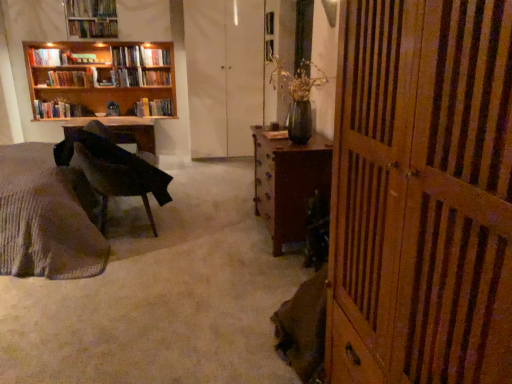
Question: Is hardcover book at upper left, which is counted as the fifth book, starting from the top, oriented towards white matte screen door at center, which ranks as the second screen door in right-to-left order?

Choices:
 (A) yes
 (B) no

Answer: (B)

Question: Does hardcover book at upper left, acting as the 3th book starting from the bottom, touch white matte screen door at center, which ranks as the second screen door in right-to-left order?

Choices:
 (A) no
 (B) yes

Answer: (A)

Question: Is hardcover book at upper left, acting as the 3th book starting from the bottom, closer to the viewer compared to white matte screen door at center, the 1th screen door from the left?

Choices:
 (A) yes
 (B) no

Answer: (B)

Question: Is hardcover book at upper left, which is counted as the fifth book, starting from the top, positioned behind white matte screen door at center, positioned as the 2th screen door in front-to-back order?

Choices:
 (A) yes
 (B) no

Answer: (A)

Question: From a real-world perspective, is hardcover book at upper left, acting as the 3th book starting from the bottom, over white matte screen door at center, positioned as the 2th screen door in front-to-back order?

Choices:
 (A) yes
 (B) no

Answer: (A)

Question: Considering the positions of velvet dark brown chair at left and hardcover book at upper center, the 5th book ordered from the bottom, in the image, is velvet dark brown chair at left taller or shorter than hardcover book at upper center, the 5th book ordered from the bottom,?

Choices:
 (A) short
 (B) tall

Answer: (B)

Question: From the image's perspective, relative to hardcover book at upper center, the 5th book ordered from the bottom, is velvet dark brown chair at left above or below?

Choices:
 (A) below
 (B) above

Answer: (A)

Question: Does point (110, 192) appear closer or farther from the camera than point (132, 62)?

Choices:
 (A) farther
 (B) closer

Answer: (B)

Question: From a real-world perspective, is velvet dark brown chair at left positioned above or below hardcover book at upper center, which is the 3th book in top-to-bottom order?

Choices:
 (A) above
 (B) below

Answer: (B)

Question: In the image, is hardcover book at upper left, acting as the 3th book starting from the bottom, on the left side or the right side of wooden screen door at right, the second screen door positioned from the top?

Choices:
 (A) left
 (B) right

Answer: (A)

Question: Is point (48, 51) closer or farther from the camera than point (418, 369)?

Choices:
 (A) farther
 (B) closer

Answer: (A)

Question: Looking at the image, does hardcover book at upper left, acting as the 3th book starting from the bottom, seem bigger or smaller compared to wooden screen door at right, the second screen door positioned from the top?

Choices:
 (A) small
 (B) big

Answer: (A)

Question: From the image's perspective, is hardcover book at upper left, which is counted as the fifth book, starting from the top, above or below wooden screen door at right, which is counted as the 2th screen door, starting from the back?

Choices:
 (A) above
 (B) below

Answer: (A)

Question: Does point (56, 54) appear closer or farther from the camera than point (89, 61)?

Choices:
 (A) farther
 (B) closer

Answer: (B)

Question: Looking at the image, does hardcover book at upper left, which is counted as the fifth book, starting from the top, seem bigger or smaller compared to hardcover book at upper left, which ranks as the 4th book in top-to-bottom order?

Choices:
 (A) small
 (B) big

Answer: (B)